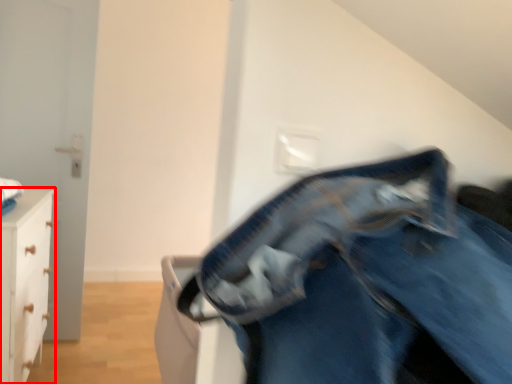
Question: Considering the relative positions of chest of drawers (annotated by the red box) and trousers in the image provided, where is chest of drawers (annotated by the red box) located with respect to the staircase?

Choices:
 (A) left
 (B) right

Answer: (A)